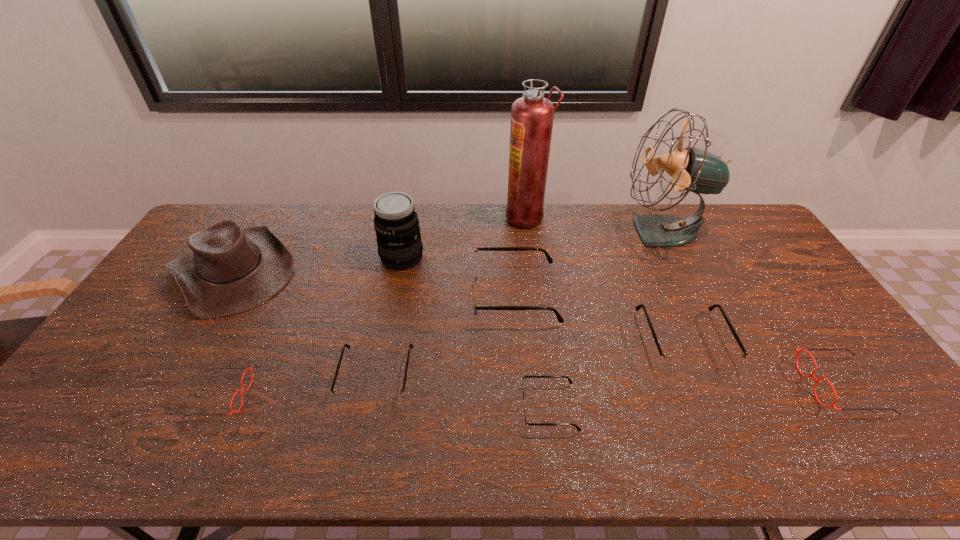
You are a GUI agent. You are given a task and a screenshot of the screen. Output one action in this format:
    pyautogui.click(x=<x>, y=<y>)
    Task: Click on the free space located on the front-facing side of the blue fan for air flow
    The width and height of the screenshot is (960, 540).
    Given the screenshot: What is the action you would take?
    pyautogui.click(x=546, y=232)

Where is `free location located on the front of the third tallest object`? The height and width of the screenshot is (540, 960). free location located on the front of the third tallest object is located at coordinates (390, 320).

Identify the location of free region located 0.260m on the front of the cowboy hat. (154, 399).

Image resolution: width=960 pixels, height=540 pixels. I want to click on vacant space situated 0.220m at the hinge ends of the biggest black spectacles, so click(399, 294).

Locate an element on the screen. This screenshot has width=960, height=540. vacant space located at the hinge ends of the biggest black spectacles is located at coordinates (405, 294).

This screenshot has height=540, width=960. I want to click on free space located 0.170m at the hinge ends of the biggest black spectacles, so click(x=416, y=294).

Where is `free region located at the hinge ends of the third smallest black spectacles`? The image size is (960, 540). free region located at the hinge ends of the third smallest black spectacles is located at coordinates tap(706, 392).

Locate an element on the screen. The height and width of the screenshot is (540, 960). vacant area situated on the front-facing side of the right red spectacles is located at coordinates (753, 386).

Identify the location of free location located on the front-facing side of the right red spectacles. coord(689,386).

Where is `free region located on the front-facing side of the right red spectacles`? The height and width of the screenshot is (540, 960). free region located on the front-facing side of the right red spectacles is located at coordinates (666, 386).